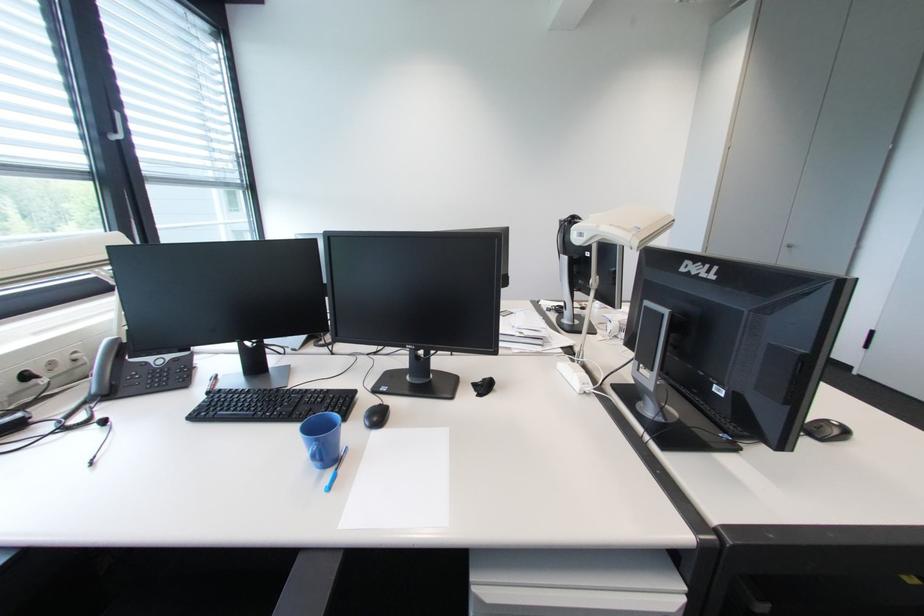
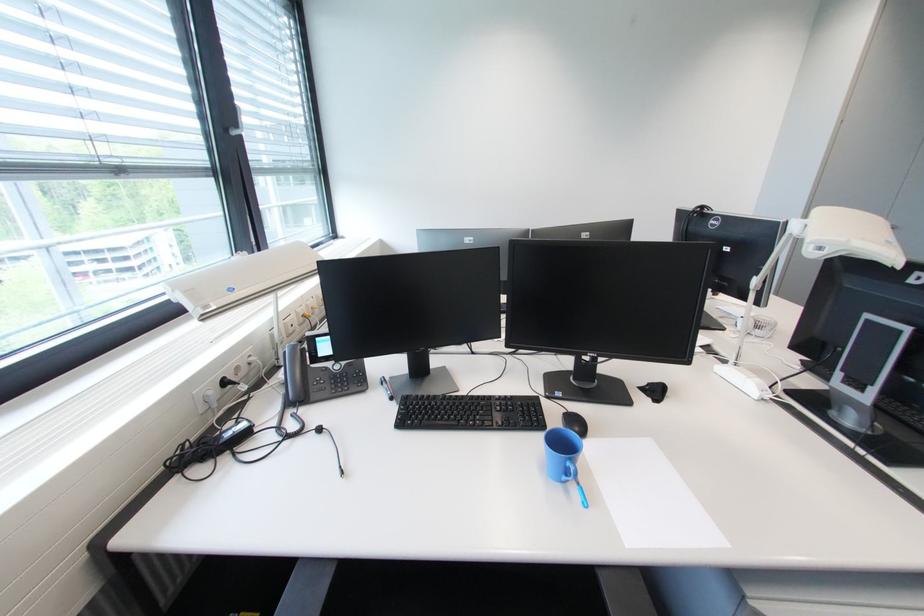
Find the pixel in the second image that matches (320,446) in the first image.

(575, 464)